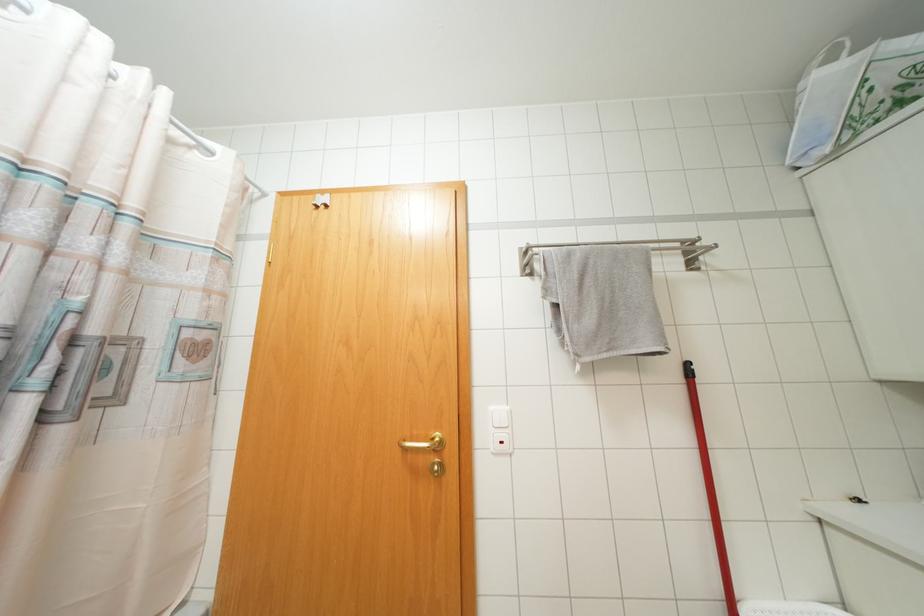
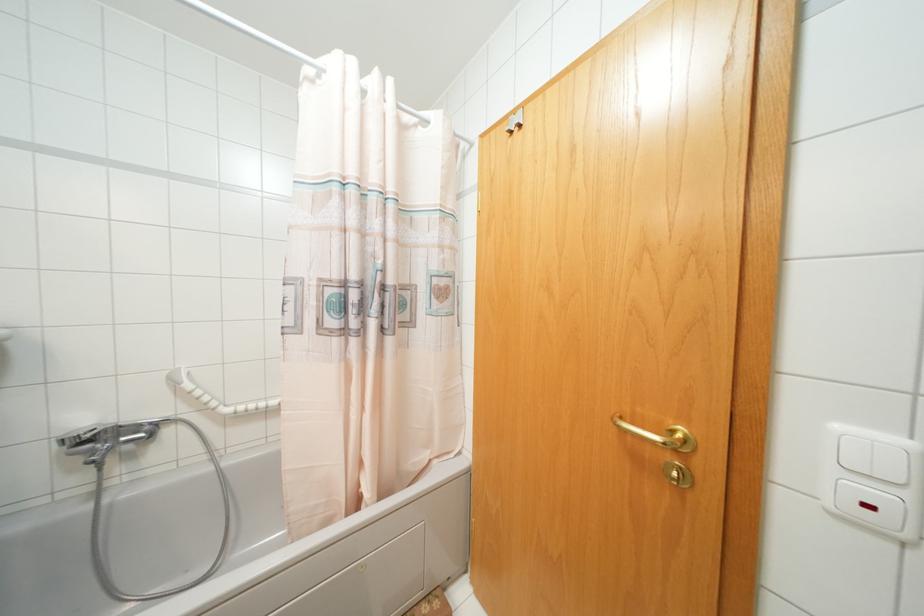
Locate, in the second image, the point that corresponds to pixel 317 207 in the first image.

(511, 132)